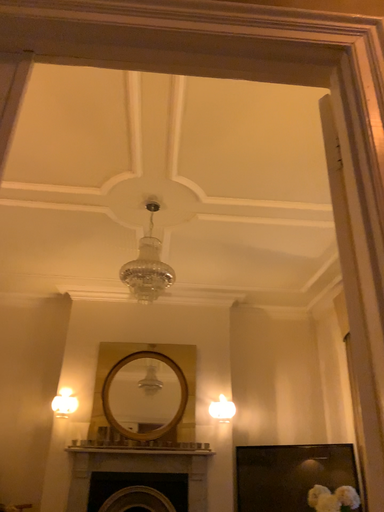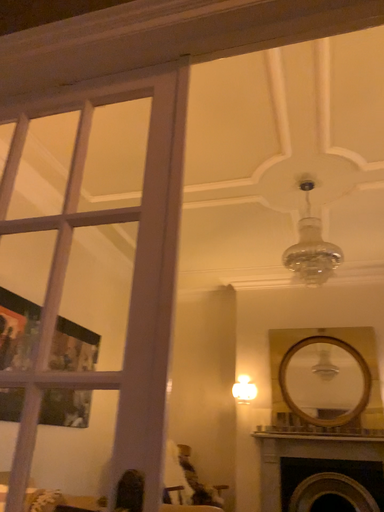
Question: How did the camera likely rotate when shooting the video?

Choices:
 (A) rotated right
 (B) rotated left

Answer: (B)